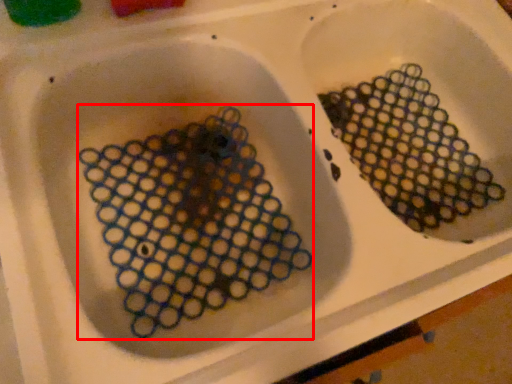
Question: Where is debris (annotated by the red box) located in relation to debris in the image?

Choices:
 (A) left
 (B) right

Answer: (A)